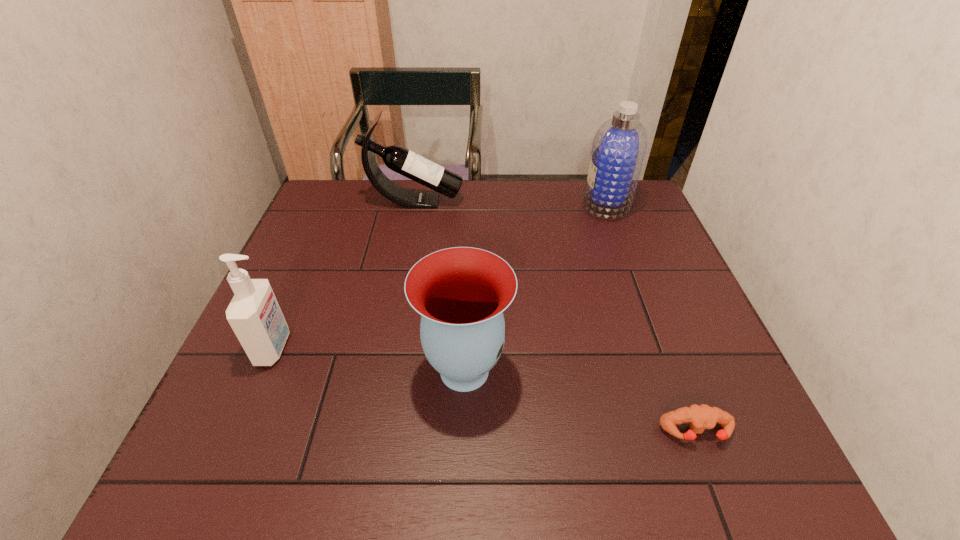
Where is `the taller cleansing agent`? This screenshot has height=540, width=960. the taller cleansing agent is located at coordinates 618,150.

The height and width of the screenshot is (540, 960). Find the location of `the farther cleansing agent`. the farther cleansing agent is located at coordinates (618, 150).

In order to click on wine bottle in this screenshot , I will do `click(397, 158)`.

Where is `the shorter cleansing agent`? the shorter cleansing agent is located at coordinates (254, 314).

Identify the location of the leftmost object. (254, 314).

Where is `vase`? vase is located at coordinates (461, 292).

At what (x,y) coordinates should I click in order to perform the action: click on the shortest object. Please return your answer as a coordinate pair (x, y). The image size is (960, 540). Looking at the image, I should click on (700, 417).

Identify the location of the nearest object. (700, 417).

Identify the location of free space located 0.220m on the front of the right cleansing agent. This screenshot has height=540, width=960. (633, 272).

Image resolution: width=960 pixels, height=540 pixels. Identify the location of vacant region located 0.110m on the stand of the wine bottle. (498, 202).